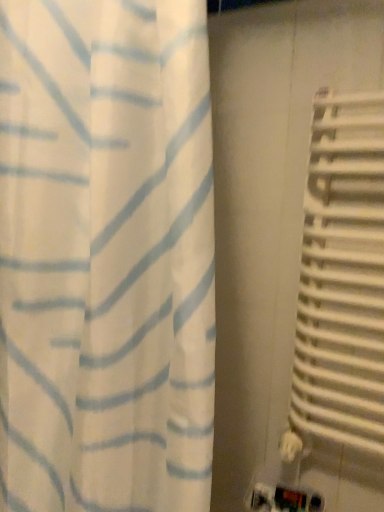
In order to click on white metallic radiator at right in this screenshot , I will do `click(342, 277)`.

Describe the element at coordinates (342, 277) in the screenshot. The width and height of the screenshot is (384, 512). I see `white metallic radiator at right` at that location.

What is the approximate width of white fabric curtain at left?

7.27 inches.

What is the approximate height of white fabric curtain at left?

38.61 inches.

This screenshot has height=512, width=384. Find the location of `white fabric curtain at left`. white fabric curtain at left is located at coordinates (106, 256).

In order to face white fabric curtain at left, should I rotate leftwards or rightwards?

To face it directly, rotate left by 19.080 degrees.

This screenshot has width=384, height=512. What do you see at coordinates (106, 256) in the screenshot?
I see `white fabric curtain at left` at bounding box center [106, 256].

Locate an element on the screen. This screenshot has height=512, width=384. white metallic radiator at right is located at coordinates (342, 277).

Can you confirm if white fabric curtain at left is positioned to the left of white metallic radiator at right?

Correct, you'll find white fabric curtain at left to the left of white metallic radiator at right.

Is the depth of white fabric curtain at left less than that of white metallic radiator at right?

Yes, the depth of white fabric curtain at left is less than that of white metallic radiator at right.

Which point is more forward, [164,401] or [336,330]?

Positioned in front is point [164,401].

From the image's perspective, would you say white fabric curtain at left is positioned over white metallic radiator at right?

No, from the image's perspective, white fabric curtain at left is not over white metallic radiator at right.

From a real-world perspective, is white fabric curtain at left beneath white metallic radiator at right?

No, from a real-world perspective, white fabric curtain at left is not under white metallic radiator at right.

Considering the relative sizes of white fabric curtain at left and white metallic radiator at right in the image provided, is white fabric curtain at left wider than white metallic radiator at right?

Indeed, white fabric curtain at left has a greater width compared to white metallic radiator at right.

Consider the image. Considering the sizes of objects white fabric curtain at left and white metallic radiator at right in the image provided, who is shorter, white fabric curtain at left or white metallic radiator at right?

Standing shorter between the two is white metallic radiator at right.

Consider the image. Considering the sizes of objects white fabric curtain at left and white metallic radiator at right in the image provided, who is smaller, white fabric curtain at left or white metallic radiator at right?

Smaller between the two is white metallic radiator at right.

From the picture: Would you say white fabric curtain at left is outside white metallic radiator at right?

Yes, white fabric curtain at left is outside of white metallic radiator at right.

Are white fabric curtain at left and white metallic radiator at right making contact?

They are not placed beside each other.

Is white fabric curtain at left aimed at white metallic radiator at right?

No, white fabric curtain at left is not oriented towards white metallic radiator at right.

How many degrees apart are the facing directions of white fabric curtain at left and white metallic radiator at right?

The angular difference between white fabric curtain at left and white metallic radiator at right is 2.66 degrees.

Measure the distance between white fabric curtain at left and white metallic radiator at right.

white fabric curtain at left is 21.22 inches away from white metallic radiator at right.

The width and height of the screenshot is (384, 512). What are the coordinates of `curtain on the left of white metallic radiator at right` in the screenshot? It's located at (106, 256).

Is white metallic radiator at right to the left of white fabric curtain at left from the viewer's perspective?

No, white metallic radiator at right is not to the left of white fabric curtain at left.

Which object is further away from the camera, white metallic radiator at right or white fabric curtain at left?

white metallic radiator at right.

Is point (298, 404) in front of point (182, 311)?

No, it is behind (182, 311).

From the image's perspective, which one is positioned lower, white metallic radiator at right or white fabric curtain at left?

From the image's view, white fabric curtain at left is below.

Consider the image. From a real-world perspective, is white metallic radiator at right above or below white fabric curtain at left?

Clearly, from a real-world perspective, white metallic radiator at right is below white fabric curtain at left.

Considering the relative sizes of white metallic radiator at right and white fabric curtain at left in the image provided, is white metallic radiator at right thinner than white fabric curtain at left?

Indeed, white metallic radiator at right has a lesser width compared to white fabric curtain at left.

Between white metallic radiator at right and white fabric curtain at left, which one has less height?

white metallic radiator at right.

Considering the relative sizes of white metallic radiator at right and white fabric curtain at left in the image provided, is white metallic radiator at right smaller than white fabric curtain at left?

Yes, white metallic radiator at right is smaller than white fabric curtain at left.

Would you say white metallic radiator at right is outside white fabric curtain at left?

That's correct, white metallic radiator at right is outside of white fabric curtain at left.

Can you see white metallic radiator at right touching white fabric curtain at left?

white metallic radiator at right is not next to white fabric curtain at left, and they're not touching.

Is white metallic radiator at right oriented towards white fabric curtain at left?

No, white metallic radiator at right is not facing towards white fabric curtain at left.

How many degrees apart are the facing directions of white metallic radiator at right and white fabric curtain at left?

2.66 degrees separate the facing orientations of white metallic radiator at right and white fabric curtain at left.

Find the location of a particular element. The image size is (384, 512). curtain lying below the white metallic radiator at right (from the image's perspective) is located at coordinates (106, 256).

The image size is (384, 512). Find the location of `curtain on the left of the white metallic radiator at right`. curtain on the left of the white metallic radiator at right is located at coordinates (106, 256).

Find the location of a particular element. Image resolution: width=384 pixels, height=512 pixels. blind below the white fabric curtain at left (from a real-world perspective) is located at coordinates (342, 277).